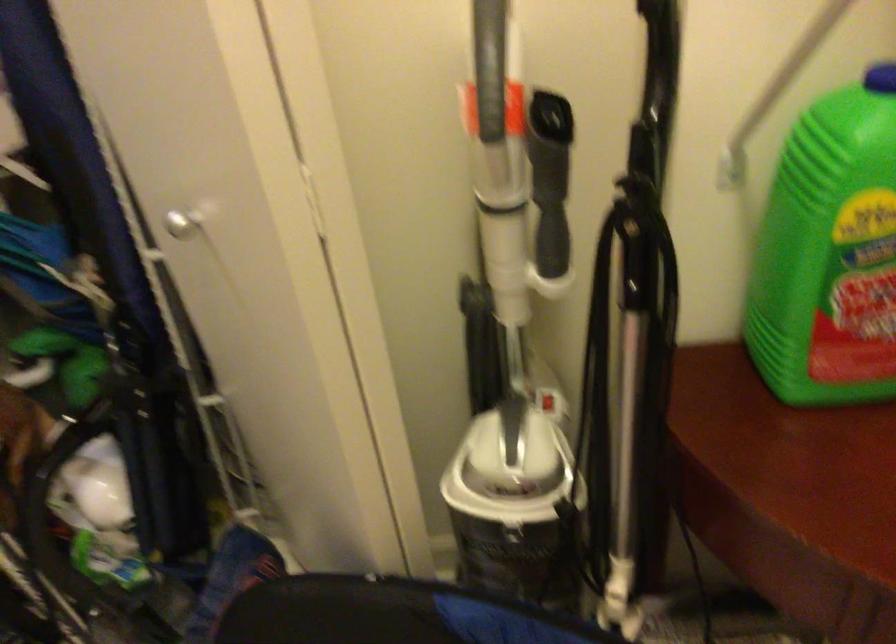
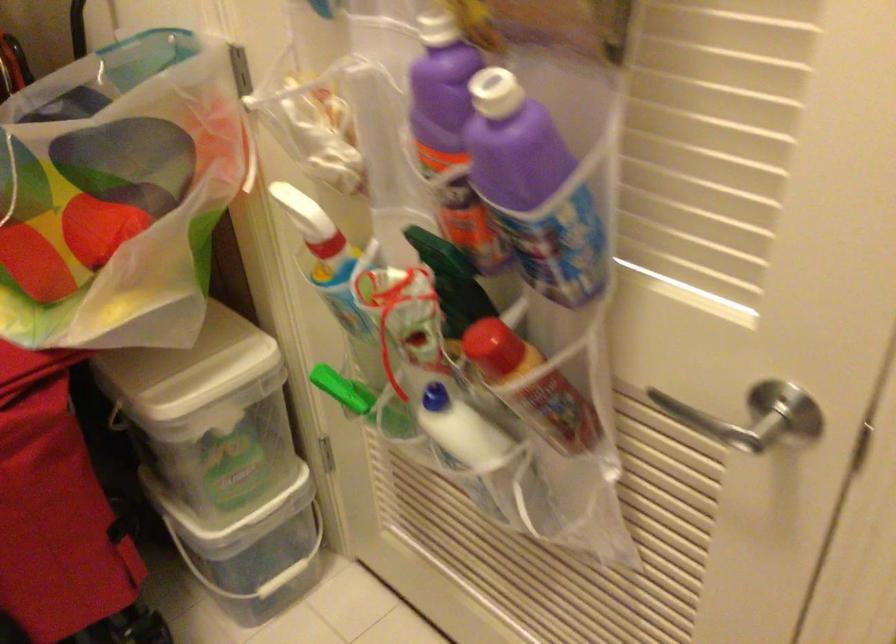
How did the camera likely rotate?

The camera's rotation is toward right-down.